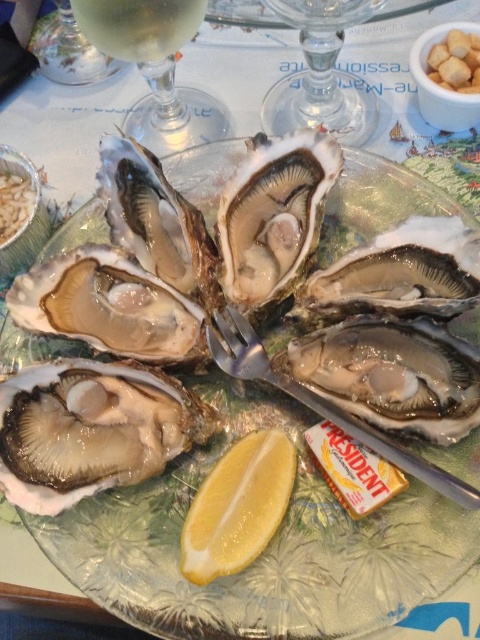
Question: Observing the image, what is the correct spatial positioning of yellow matte lemon at center in reference to white creamy croutons at upper right?

Choices:
 (A) above
 (B) below

Answer: (B)

Question: Can you confirm if shiny silver oyster at center is positioned to the left of transparent glass at upper center?

Choices:
 (A) no
 (B) yes

Answer: (B)

Question: Estimate the real-world distances between objects in this image. Which object is closer to the yellow matte lemon at center?

Choices:
 (A) shiny silver oyster at center
 (B) transparent glass wine glass at upper left

Answer: (A)

Question: Which point appears farthest from the camera in this image?

Choices:
 (A) (299, 112)
 (B) (204, 10)
 (C) (282, 484)
 (D) (455, 67)

Answer: (A)

Question: In this image, where is transparent glass wine glass at upper left located relative to matte glass oyster at center?

Choices:
 (A) right
 (B) left

Answer: (A)

Question: Which object is the closest to the yellow matte lemon at center?

Choices:
 (A) transparent glass wine glass at upper left
 (B) matte glass oyster at center
 (C) shiny silver oyster at center
 (D) white creamy croutons at upper right

Answer: (C)